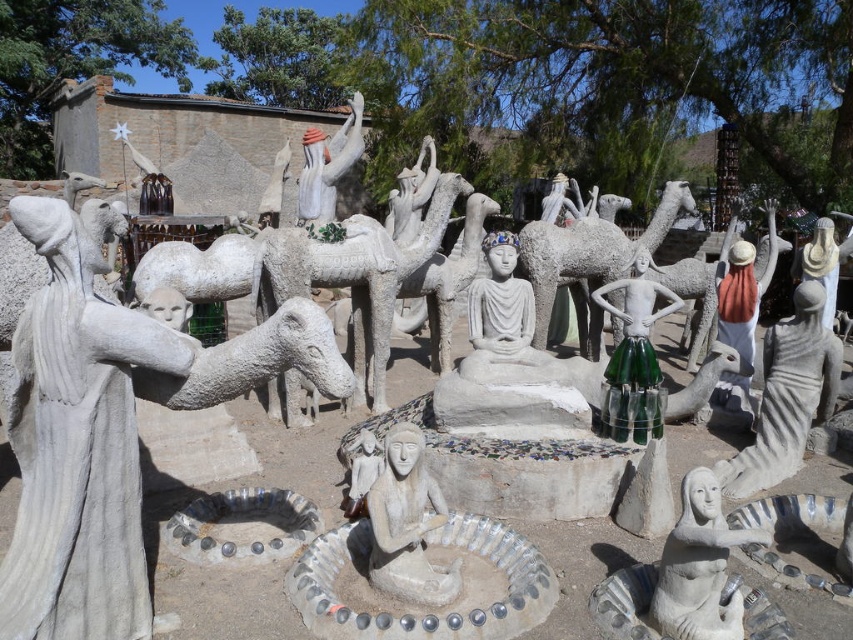
The height and width of the screenshot is (640, 853). What do you see at coordinates (109, 429) in the screenshot? I see `white stone statue at left` at bounding box center [109, 429].

Can you confirm if white stone statue at left is positioned to the right of white stone figure at center?

Incorrect, white stone statue at left is not on the right side of white stone figure at center.

Is point (21, 333) positioned in front of point (340, 129)?

Yes, it is.

This screenshot has height=640, width=853. I want to click on white stone statue at left, so click(x=109, y=429).

Between point (635, 307) and point (306, 141), which one is positioned in front?

Point (635, 307) is in front.

Can you confirm if green glass skirt at center is positioned to the right of white stone figure at center?

Yes, green glass skirt at center is to the right of white stone figure at center.

Between point (621, 349) and point (306, 141), which one is positioned in front?

Point (621, 349) is in front.

Locate an element on the screen. This screenshot has width=853, height=640. green glass skirt at center is located at coordinates tap(634, 356).

Is point (125, 372) positioned in front of point (521, 340)?

Yes.

Is white stone statue at left smaller than white stone statue at center?

No.

Where is `white stone statue at left`? This screenshot has height=640, width=853. white stone statue at left is located at coordinates (109, 429).

Where is `white stone statue at left`? Image resolution: width=853 pixels, height=640 pixels. white stone statue at left is located at coordinates (109, 429).